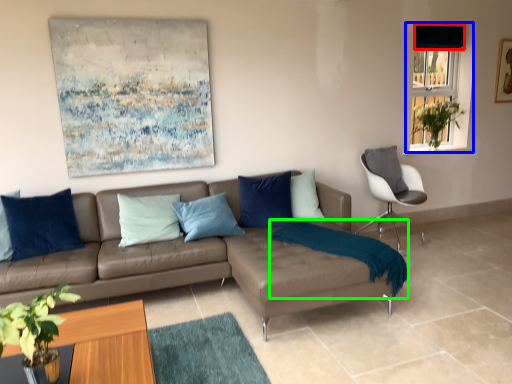
Question: Which object is the closest to the curtain (highlighted by a red box)? Choose among these: window (highlighted by a blue box) or blanket (highlighted by a green box).

Choices:
 (A) window
 (B) blanket

Answer: (A)